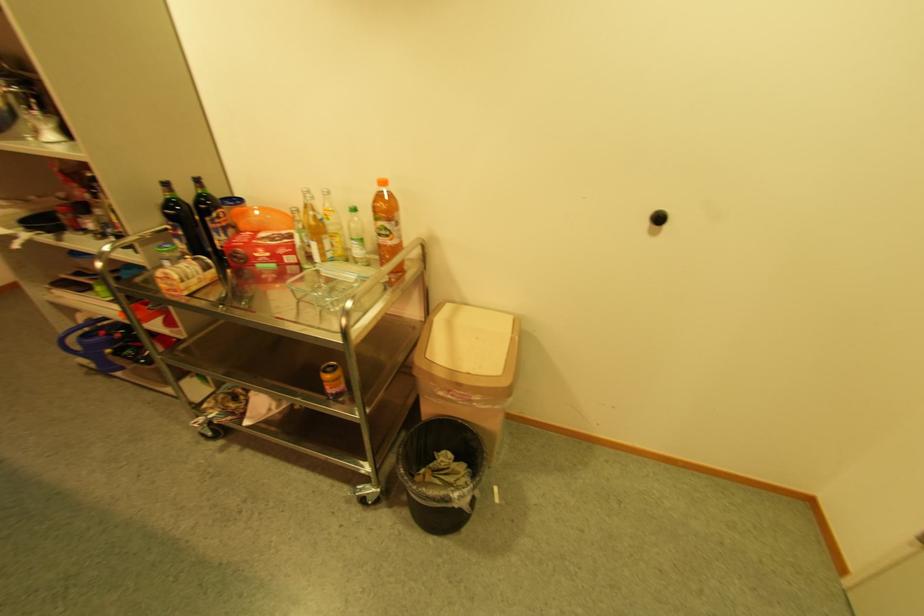
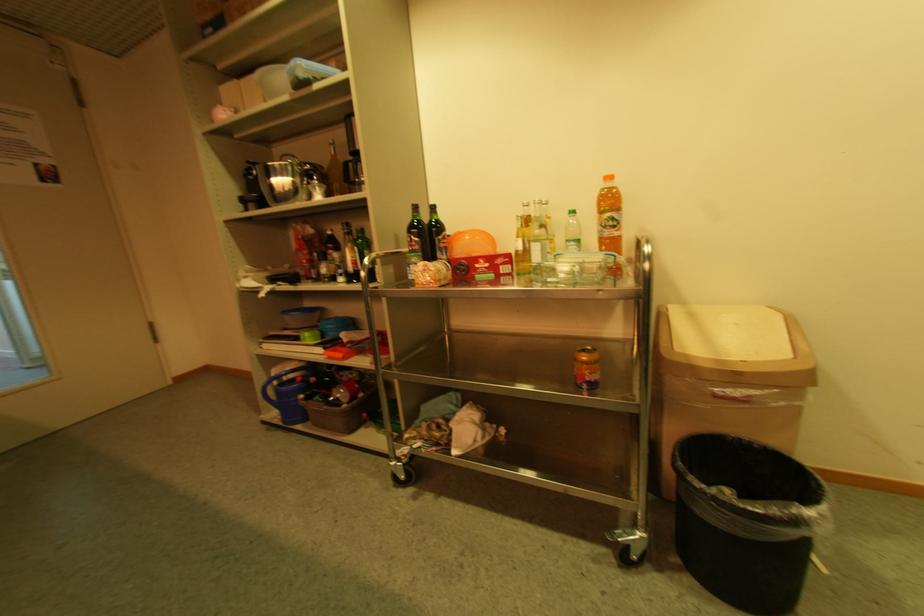
Question: What movement of the cameraman would produce the second image?

Choices:
 (A) Left
 (B) Right
 (C) Forward
 (D) Backward

Answer: (A)